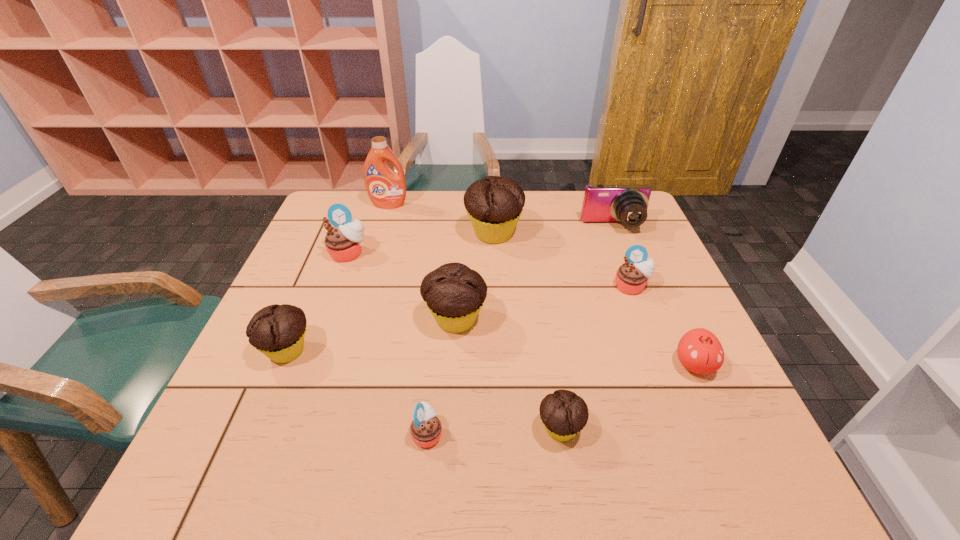
Locate which object is the fifth closest to the camera. Please provide its 2D coordinates. Your answer should be formatted as a tuple, i.e. [(x, y)], where the tuple contains the x and y coordinates of a point satisfying the conditions above.

[(386, 188)]

Where is `muffin that is the second closest to the rightmost pink muffin`? The width and height of the screenshot is (960, 540). muffin that is the second closest to the rightmost pink muffin is located at coordinates (454, 293).

I want to click on muffin that is the fourth closest to the red apple, so click(494, 204).

Locate which chocolate muffin ranks second in proximity to the leftmost pink muffin. Please provide its 2D coordinates. Your answer should be formatted as a tuple, i.e. [(x, y)], where the tuple contains the x and y coordinates of a point satisfying the conditions above.

[(278, 331)]

Where is `the fourth closest chocolate muffin to the camera`? the fourth closest chocolate muffin to the camera is located at coordinates (278, 331).

Locate which pink muffin ranks in proximity to the farthest object. Please provide its 2D coordinates. Your answer should be formatted as a tuple, i.e. [(x, y)], where the tuple contains the x and y coordinates of a point satisfying the conditions above.

[(343, 242)]

At what (x,y) coordinates should I click in order to perform the action: click on pink muffin that stands as the second closest to the farthest pink muffin. Please return your answer as a coordinate pair (x, y). Looking at the image, I should click on (631, 277).

Identify the location of vacant region that satisfies the following two spatial constraints: 1. on the back side of the farthest chocolate muffin; 2. on the left side of the third biggest chocolate muffin. The width and height of the screenshot is (960, 540). (336, 233).

Identify the location of vacant space that satisfies the following two spatial constraints: 1. on the front-facing side of the farthest chocolate muffin; 2. on the right side of the detergent. (380, 233).

The image size is (960, 540). I want to click on free space that satisfies the following two spatial constraints: 1. on the front-facing side of the tallest object; 2. on the left side of the red apple, so click(342, 365).